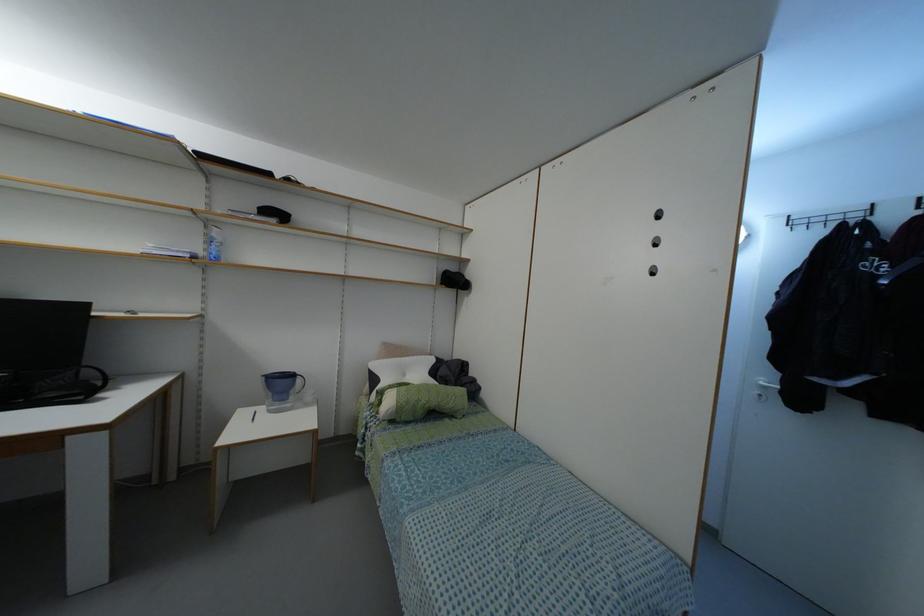
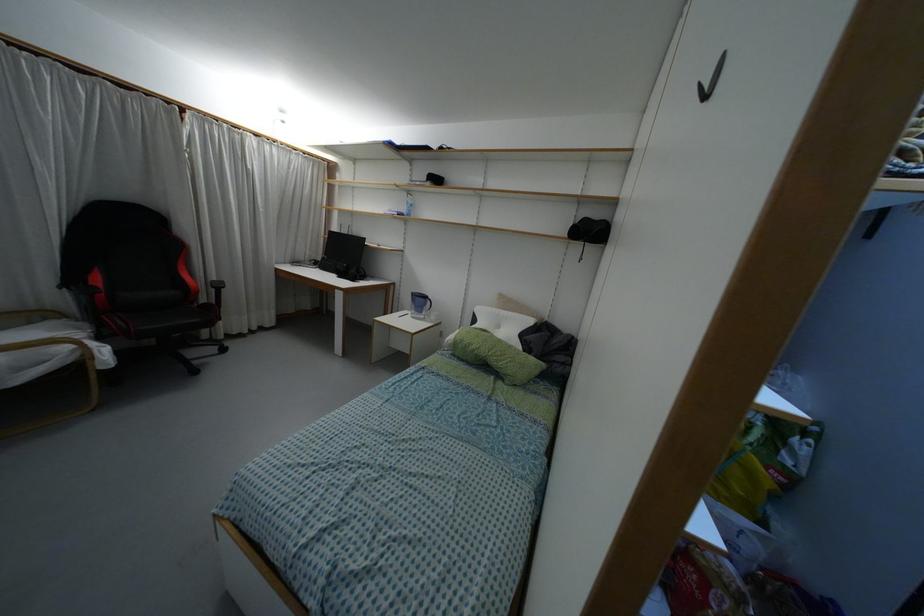
Find the pixel in the second image that matches [207,223] in the first image.

(407, 192)